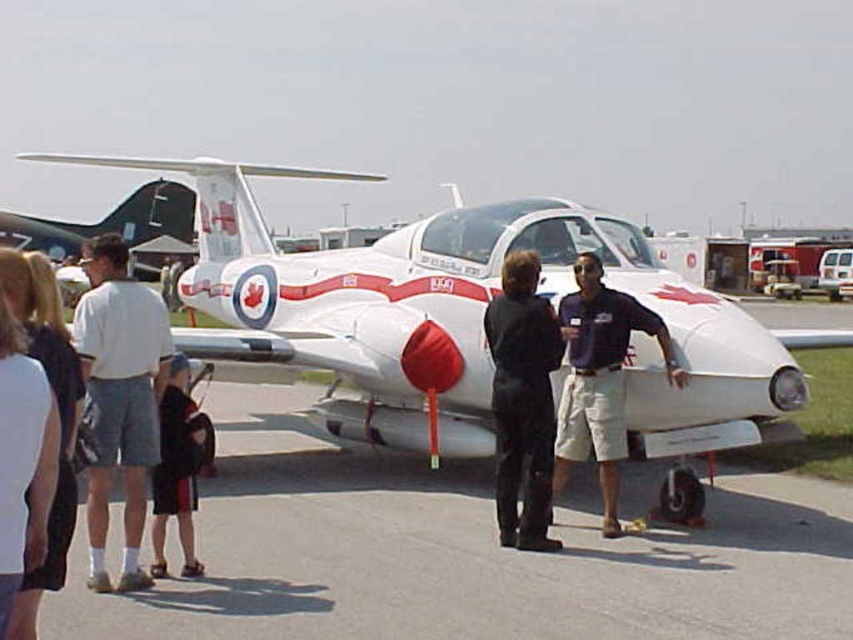
You are a photographer at the airshow trying to capture a closeup of the maple leaf emblem on the aircraft. You have two props available for placement in the scene to draw attention to the emblem. The props are a black leather pants at center and a white cotton shirt at left. Which prop should you place farther away from the emblem to ensure it doesn t block the view?

The black leather pants at center is larger in size compared to the white cotton shirt at left. To avoid blocking the emblem, place the larger prop farther away. Therefore, the black leather pants at center should be placed farther away from the emblem.